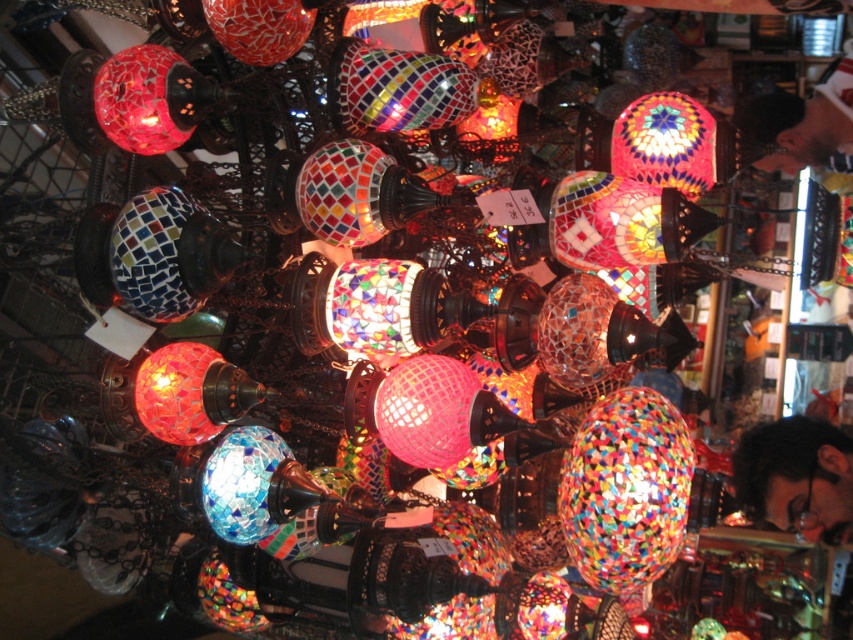
You are a customer in a store looking at the mosaic glass lamp at upper left and the dark brown leather jacket at upper right. Which item is positioned higher up in the image?

The dark brown leather jacket at upper right is positioned higher up because the mosaic glass lamp at upper left is below it.